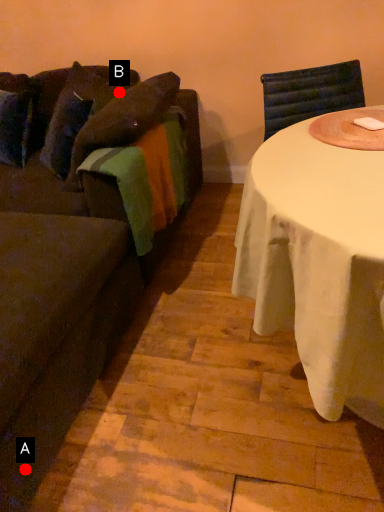
Question: Two points are circled on the image, labeled by A and B beside each circle. Which of the following is the closest to the observer?

Choices:
 (A) A is closer
 (B) B is closer

Answer: (A)